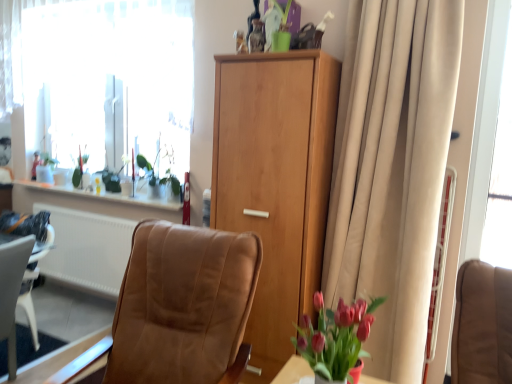
Question: From the image's perspective, relative to green glossy vase at upper left, marked as the second plant in a right-to-left arrangement, is beige fabric curtain at right above or below?

Choices:
 (A) below
 (B) above

Answer: (A)

Question: Considering the positions of point (455, 205) and point (80, 175), is point (455, 205) closer or farther from the camera than point (80, 175)?

Choices:
 (A) farther
 (B) closer

Answer: (B)

Question: Which of these objects is positioned farthest from the green glossy vase at upper left, which appears as the second plant when viewed from the front?

Choices:
 (A) white matte radiator at lower left
 (B) leather-like brown chair at center
 (C) beige fabric curtain at right
 (D) light brown wood cabinet at center
 (E) white sheer curtain at upper left

Answer: (C)

Question: Which is farther from the white matte radiator at lower left?

Choices:
 (A) green glossy vase at upper left, which is the first plant in back-to-front order
 (B) white sheer curtain at upper left
 (C) leather-like brown chair at center
 (D) green matte plant at upper left, marked as the first plant in a right-to-left arrangement
 (E) light brown wood cabinet at center

Answer: (C)